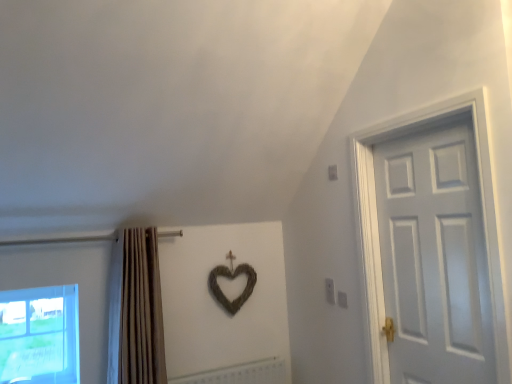
Locate an element on the screen. beige fabric curtain at left is located at coordinates (136, 310).

Measure the distance between point (57, 311) and camera.

Point (57, 311) is 9.43 feet from camera.

This screenshot has height=384, width=512. I want to click on white matte door at right, so click(x=434, y=256).

From a real-world perspective, is beige fabric curtain at left positioned under white matte door at right based on gravity?

Yes, from a real-world perspective, beige fabric curtain at left is beneath white matte door at right.

What are the coordinates of `curtain below the white matte door at right (from a real-world perspective)` in the screenshot? It's located at (136, 310).

From the image's perspective, which is below, beige fabric curtain at left or white matte door at right?

beige fabric curtain at left.

Is beige fabric curtain at left located outside white matte door at right?

beige fabric curtain at left lies outside white matte door at right's area.

In the scene shown: What's the angular difference between white matte radiator at center and beige fabric curtain at left's facing directions?

They differ by 3.16 degrees in their facing directions.

Considering their positions, is white matte radiator at center located in front of or behind beige fabric curtain at left?

white matte radiator at center is behind beige fabric curtain at left.

In the image, there is a beige fabric curtain at left. At what (x,y) coordinates should I click in order to perform the action: click on radiator below it (from the image's perspective). Please return your answer as a coordinate pair (x, y). Looking at the image, I should click on (240, 374).

Based on their positions, is white matte radiator at center located to the left or right of white matte door at right?

In the image, white matte radiator at center appears on the left side of white matte door at right.

Is white matte radiator at center bigger or smaller than white matte door at right?

Considering their sizes, white matte radiator at center takes up less space than white matte door at right.

Locate an element on the screen. This screenshot has height=384, width=512. door that appears above the white matte radiator at center (from the image's perspective) is located at coordinates point(434,256).

Considering the relative sizes of transparent glass window at lower left and beige fabric curtain at left in the image provided, is transparent glass window at lower left smaller than beige fabric curtain at left?

Correct, transparent glass window at lower left occupies less space than beige fabric curtain at left.

Is transparent glass window at lower left positioned with its back to beige fabric curtain at left?

transparent glass window at lower left is not turned away from beige fabric curtain at left.

Looking at this image, from the image's perspective, is transparent glass window at lower left on beige fabric curtain at left?

Incorrect, from the image's perspective, transparent glass window at lower left is lower than beige fabric curtain at left.

Is transparent glass window at lower left far away from beige fabric curtain at left?

transparent glass window at lower left is near beige fabric curtain at left, not far away.

Can you confirm if beige fabric curtain at left is bigger than white matte radiator at center?

Correct, beige fabric curtain at left is larger in size than white matte radiator at center.

From the picture: Could you tell me if beige fabric curtain at left is turned towards white matte radiator at center?

No, beige fabric curtain at left is not turned towards white matte radiator at center.

Is point (125, 241) positioned before point (231, 379)?

Yes, it is.

From the image's perspective, which is below, beige fabric curtain at left or white matte radiator at center?

white matte radiator at center.

Looking at the image, does beige fabric curtain at left seem bigger or smaller compared to transparent glass window at lower left?

Considering their sizes, beige fabric curtain at left takes up more space than transparent glass window at lower left.

How many degrees apart are the facing directions of beige fabric curtain at left and transparent glass window at lower left?

They differ by 1.26 degrees in their facing directions.

From the picture: Is beige fabric curtain at left positioned with its back to transparent glass window at lower left?

That's not correct — beige fabric curtain at left is not looking away from transparent glass window at lower left.

Would you say transparent glass window at lower left is part of beige fabric curtain at left's contents?

That's incorrect, transparent glass window at lower left is not inside beige fabric curtain at left.

In the scene shown: Is white matte door at right facing away from transparent glass window at lower left?

No, white matte door at right is not facing the opposite direction of transparent glass window at lower left.

Considering the relative sizes of white matte door at right and transparent glass window at lower left in the image provided, is white matte door at right bigger than transparent glass window at lower left?

Correct, white matte door at right is larger in size than transparent glass window at lower left.

You are a GUI agent. You are given a task and a screenshot of the screen. Output one action in this format:
    pyautogui.click(x=<x>, y=<y>)
    Task: Click on the window behind the white matte door at right
    
    Given the screenshot: What is the action you would take?
    pyautogui.click(x=39, y=335)

Would you say white matte door at right contains transparent glass window at lower left?

That's incorrect, transparent glass window at lower left is not inside white matte door at right.

Where is `curtain located on the left of white matte door at right`? curtain located on the left of white matte door at right is located at coordinates (136, 310).

The width and height of the screenshot is (512, 384). Find the location of `radiator below the beige fabric curtain at left (from the image's perspective)`. radiator below the beige fabric curtain at left (from the image's perspective) is located at coordinates (240, 374).

When comparing their distances from white matte door at right, does transparent glass window at lower left or beige fabric curtain at left seem closer?

beige fabric curtain at left lies closer to white matte door at right than the other object.

Looking at the image, which one is located closer to white matte radiator at center, white matte door at right or transparent glass window at lower left?

Based on the image, transparent glass window at lower left appears to be nearer to white matte radiator at center.

Estimate the real-world distances between objects in this image. Which object is further from white matte radiator at center, beige fabric curtain at left or transparent glass window at lower left?

Based on the image, transparent glass window at lower left appears to be further to white matte radiator at center.

When comparing their distances from transparent glass window at lower left, does white matte radiator at center or beige fabric curtain at left seem closer?

Among the two, beige fabric curtain at left is located nearer to transparent glass window at lower left.

Which object lies nearer to the anchor point white matte door at right, beige fabric curtain at left or white matte radiator at center?

Among the two, white matte radiator at center is located nearer to white matte door at right.

When comparing their distances from white matte door at right, does white matte radiator at center or beige fabric curtain at left seem further?

The object further to white matte door at right is beige fabric curtain at left.

When comparing their distances from white matte radiator at center, does white matte door at right or beige fabric curtain at left seem further?

white matte door at right.

From the image, which object appears to be nearer to white matte door at right, transparent glass window at lower left or white matte radiator at center?

white matte radiator at center is closer to white matte door at right.

Where is `curtain situated between transparent glass window at lower left and white matte door at right from left to right`? curtain situated between transparent glass window at lower left and white matte door at right from left to right is located at coordinates (136, 310).

In order to click on radiator between beige fabric curtain at left and white matte door at right in the horizontal direction in this screenshot , I will do `click(240, 374)`.

Locate an element on the screen. This screenshot has height=384, width=512. curtain between transparent glass window at lower left and white matte radiator at center from left to right is located at coordinates (136, 310).

Where is `radiator between transparent glass window at lower left and white matte door at right from left to right`? This screenshot has width=512, height=384. radiator between transparent glass window at lower left and white matte door at right from left to right is located at coordinates (240, 374).